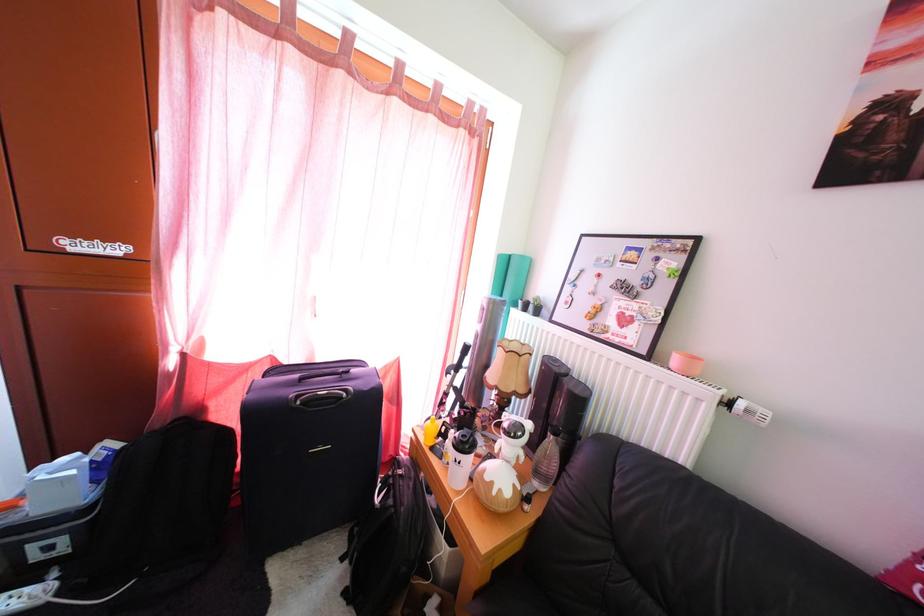
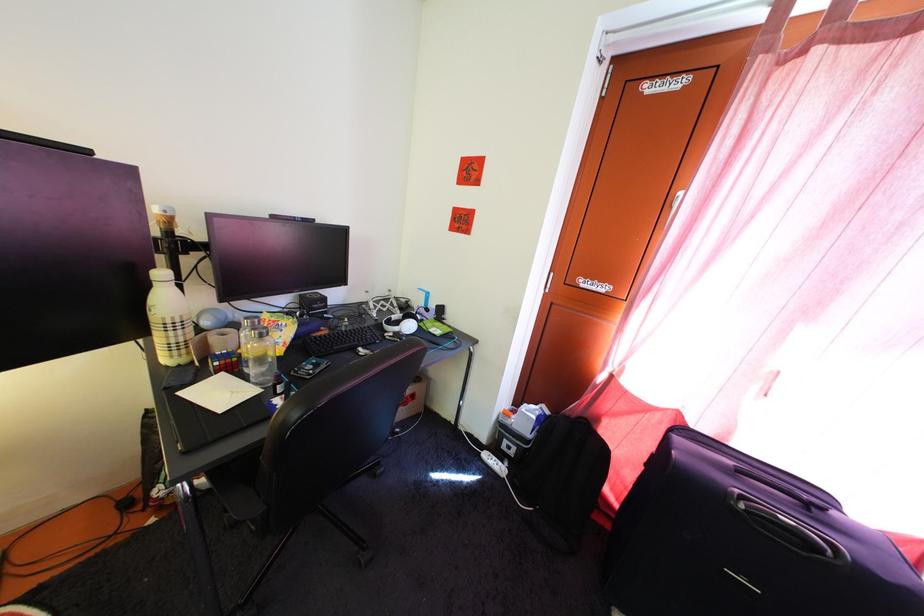
In the second image, find the point that corresponds to point (307, 411) in the first image.

(751, 515)